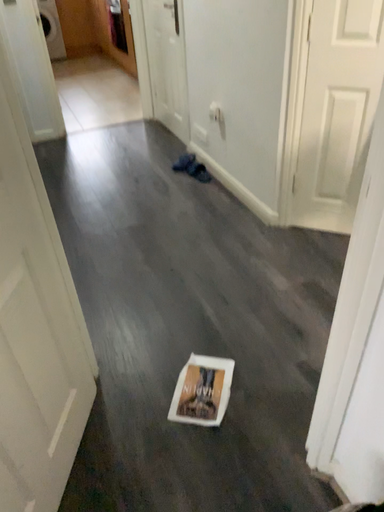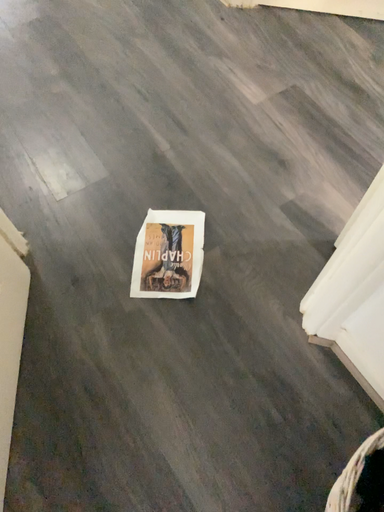
Question: How did the camera likely rotate when shooting the video?

Choices:
 (A) rotated left
 (B) rotated right

Answer: (B)